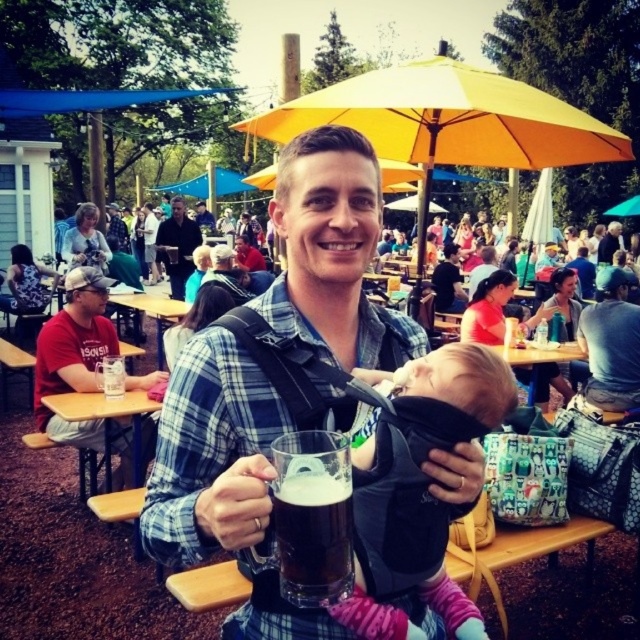
From the picture: You are a photographer trying to capture the man in the blue and white plaid shirt holding a dark matte glass mug at center and wearing a smooth black shirt at center. Which object is located to the right of the other?

The dark matte glass mug at center is positioned on the right side of smooth black shirt at center, so the mug is to the right of the shirt.

You are standing in the outdoor dining area and want to take a photo of the man holding the mug and the baby. Which of the two points, point (346, 561) or point (198, 208), is closer to you when focusing your camera?

Point (346, 561) is closer to the viewer than point (198, 208), so you should focus on that point first.